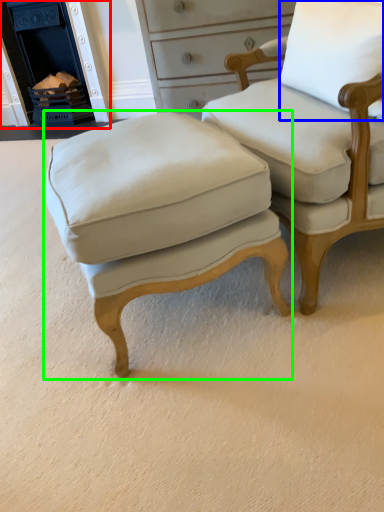
Question: Which object is positioned closest to fireplace (highlighted by a red box)? Select from pillow (highlighted by a blue box) and stool (highlighted by a green box).

Choices:
 (A) pillow
 (B) stool

Answer: (B)